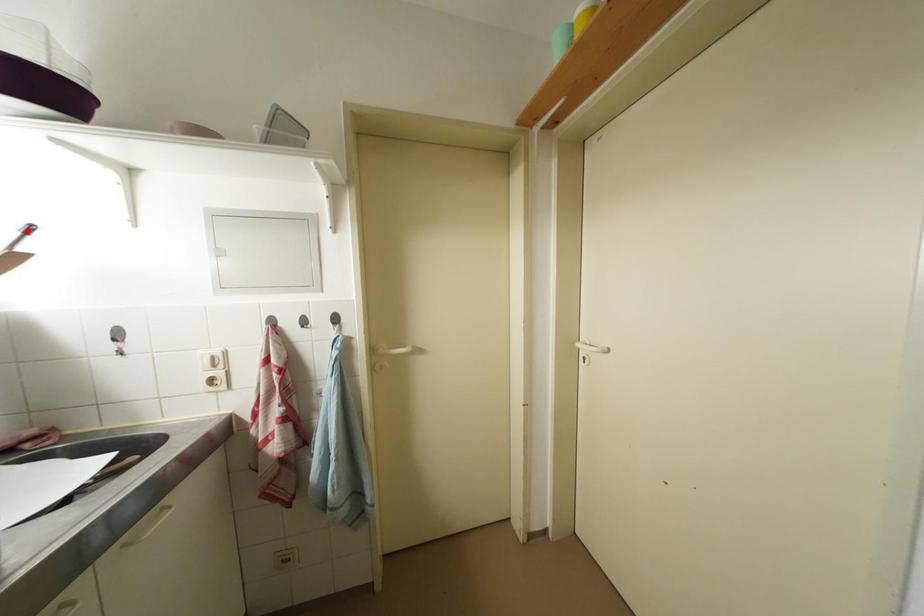
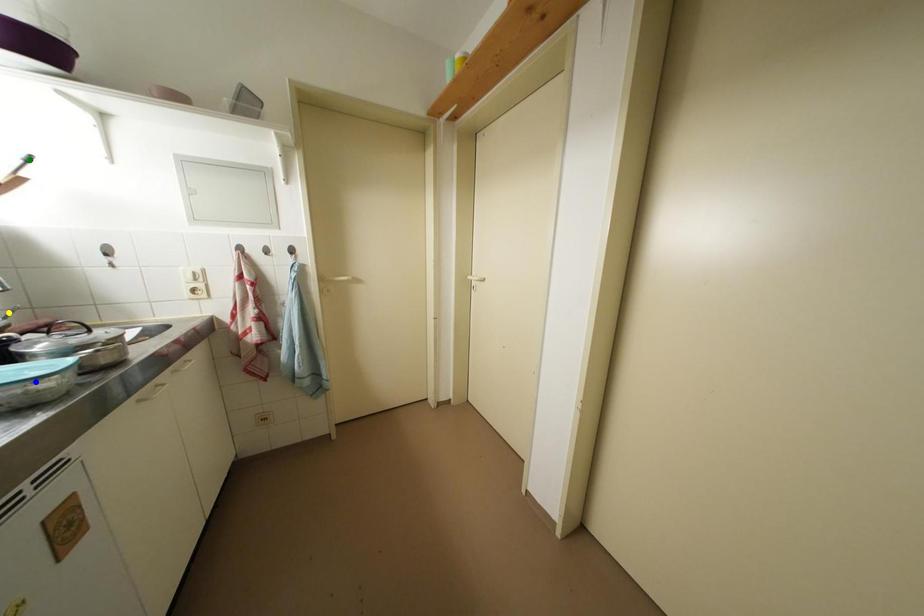
Question: I am providing you with two images of the same scene from different viewpoints. A red point is marked on the first image. You are given multiple points on the second image. Can you choose the point in image 2 that corresponds to the point in image 1?

Choices:
 (A) green point
 (B) yellow point
 (C) blue point

Answer: (A)